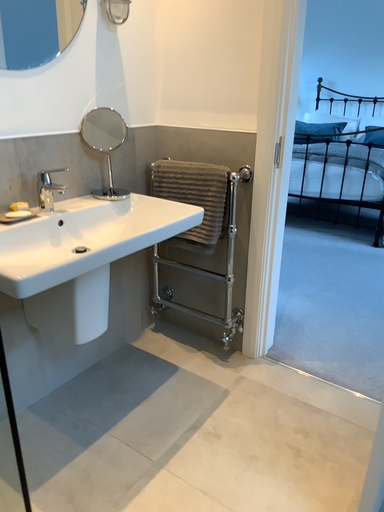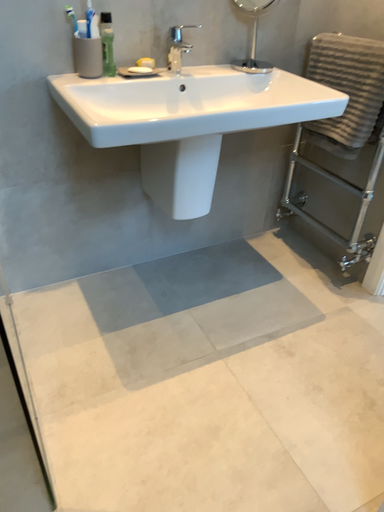
Question: How did the camera likely rotate when shooting the video?

Choices:
 (A) rotated left
 (B) rotated right

Answer: (A)